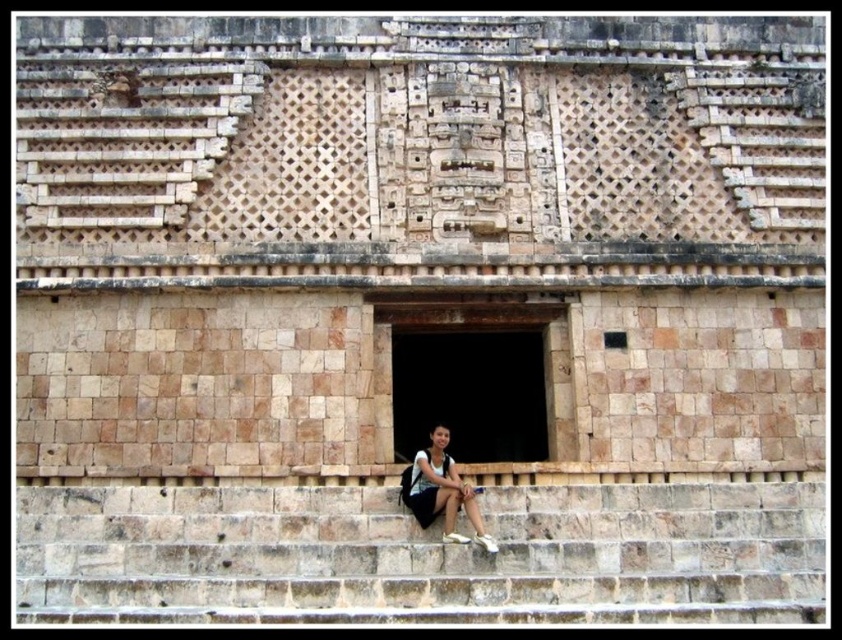
Looking at this image, you are standing in front of the ancient stone structure and want to enter through the central doorway. To do so, you need to climb the brown stone stairs at lower center. Based on their position, are the stairs located directly in front of the doorway or to the side?

The brown stone stairs at lower center are positioned at coordinates point (x=421, y=554), which places them directly in front of the doorway, making them the access point to enter through the central doorway.

You are standing in front of an ancient stone structure and see the brown stone stairs at lower center and the matte black backpack at lower center. Which object is larger in size?

The brown stone stairs at lower center is bigger than the matte black backpack at lower center according to the description.

You are standing in front of an ancient stone structure and see the brown stone stairs at lower center and the matte black backpack at lower center. Which object is closer to the ground?

The brown stone stairs at lower center are closer to the ground because they are positioned under the matte black backpack at lower center.